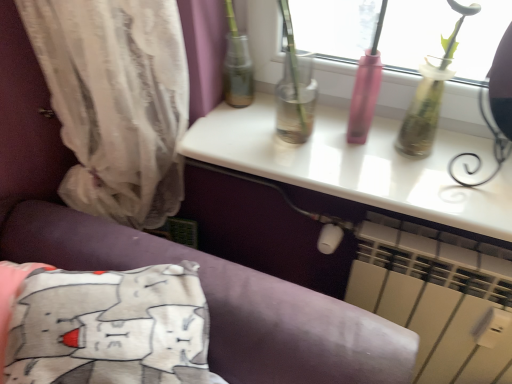
Question: From a real-world perspective, is white cotton pillow at lower left over white glossy table at upper center?

Choices:
 (A) no
 (B) yes

Answer: (A)

Question: Is white cotton pillow at lower left thinner than white glossy table at upper center?

Choices:
 (A) no
 (B) yes

Answer: (A)

Question: From a real-world perspective, is white cotton pillow at lower left below white glossy table at upper center?

Choices:
 (A) no
 (B) yes

Answer: (B)

Question: Are white cotton pillow at lower left and white glossy table at upper center beside each other?

Choices:
 (A) no
 (B) yes

Answer: (A)

Question: Is the depth of white cotton pillow at lower left greater than that of white glossy table at upper center?

Choices:
 (A) no
 (B) yes

Answer: (A)

Question: Relative to white glossy table at upper center, is white cotton pillow at lower left in front or behind?

Choices:
 (A) behind
 (B) front

Answer: (B)

Question: Is white cotton pillow at lower left situated inside white glossy table at upper center or outside?

Choices:
 (A) outside
 (B) inside

Answer: (A)

Question: In terms of width, does white cotton pillow at lower left look wider or thinner when compared to white glossy table at upper center?

Choices:
 (A) wide
 (B) thin

Answer: (A)

Question: From a real-world perspective, is white cotton pillow at lower left above or below white glossy table at upper center?

Choices:
 (A) below
 (B) above

Answer: (A)

Question: Considering the positions of white cotton pillow at lower left and white plastic radiator at lower right in the image, is white cotton pillow at lower left wider or thinner than white plastic radiator at lower right?

Choices:
 (A) wide
 (B) thin

Answer: (A)

Question: Is white cotton pillow at lower left bigger or smaller than white plastic radiator at lower right?

Choices:
 (A) big
 (B) small

Answer: (A)

Question: From a real-world perspective, is white cotton pillow at lower left physically located above or below white plastic radiator at lower right?

Choices:
 (A) above
 (B) below

Answer: (A)

Question: Would you say white cotton pillow at lower left is to the left or to the right of white plastic radiator at lower right in the picture?

Choices:
 (A) left
 (B) right

Answer: (A)

Question: Would you say white plastic radiator at lower right is inside or outside translucent fabric curtain at left?

Choices:
 (A) inside
 (B) outside

Answer: (B)

Question: Is white plastic radiator at lower right to the left or to the right of translucent fabric curtain at left in the image?

Choices:
 (A) right
 (B) left

Answer: (A)